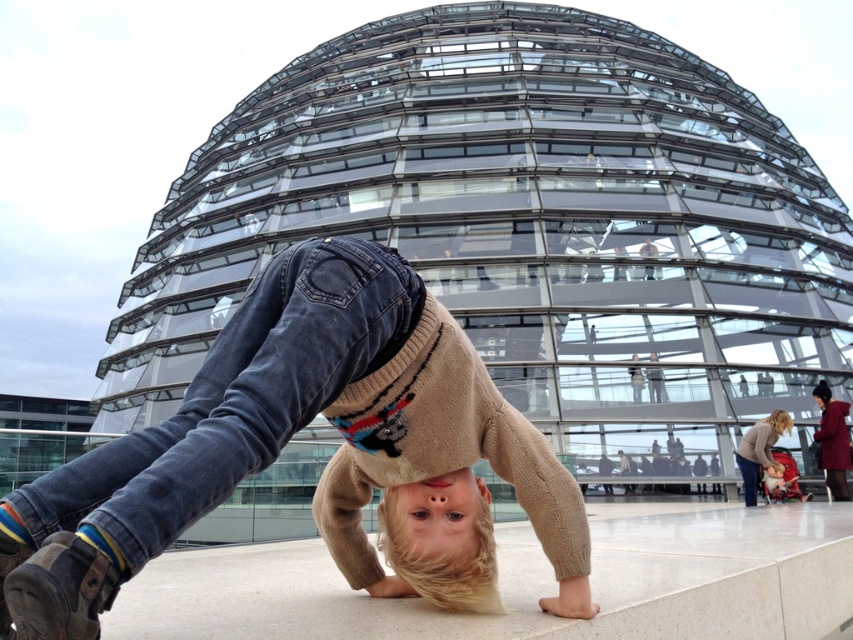
Between point (74, 625) and point (757, 468), which one is positioned in front?

Point (74, 625) is in front.

Who is taller, knitted sweater at center or light brown sweater at lower right?

With more height is knitted sweater at center.

Where is `knitted sweater at center`? This screenshot has height=640, width=853. knitted sweater at center is located at coordinates (328, 464).

This screenshot has height=640, width=853. Find the location of `knitted sweater at center`. knitted sweater at center is located at coordinates (328, 464).

Does blonde hair at center appear on the right side of light brown sweater at lower right?

In fact, blonde hair at center is to the left of light brown sweater at lower right.

Between blonde hair at center and light brown sweater at lower right, which one has less height?

With less height is light brown sweater at lower right.

Identify the location of blonde hair at center. (438, 540).

Locate an element on the screen. The width and height of the screenshot is (853, 640). blonde hair at center is located at coordinates (438, 540).

Is point (257, 412) farther from camera compared to point (440, 540)?

No, it is in front of (440, 540).

Does knitted sweater at center have a greater height compared to blonde hair at center?

Yes, knitted sweater at center is taller than blonde hair at center.

Describe the element at coordinates (328, 464) in the screenshot. I see `knitted sweater at center` at that location.

Where is `knitted sweater at center`? knitted sweater at center is located at coordinates point(328,464).